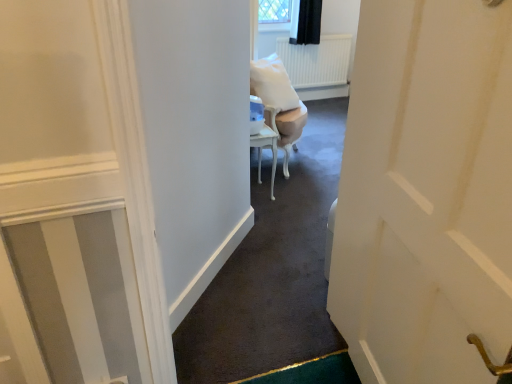
Locate an element on the screen. This screenshot has height=384, width=512. empty space that is to the right of white glossy chair at center is located at coordinates (319, 157).